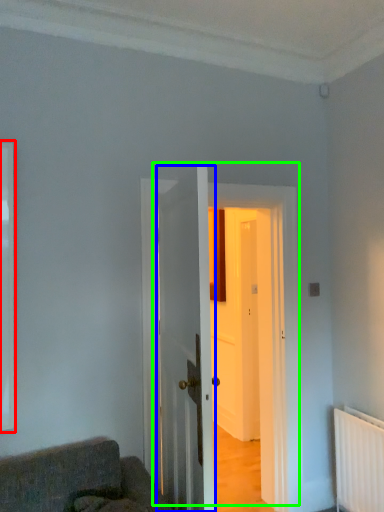
Question: Which object is the closest to the window (highlighted by a red box)? Choose among these: door (highlighted by a blue box) or door (highlighted by a green box).

Choices:
 (A) door
 (B) door

Answer: (B)